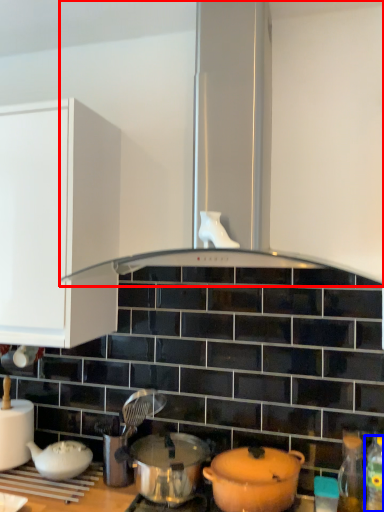
Question: Which of the following is the closest to the observer, exhaust hood (highlighted by a red box) or bottle (highlighted by a blue box)?

Choices:
 (A) exhaust hood
 (B) bottle

Answer: (A)